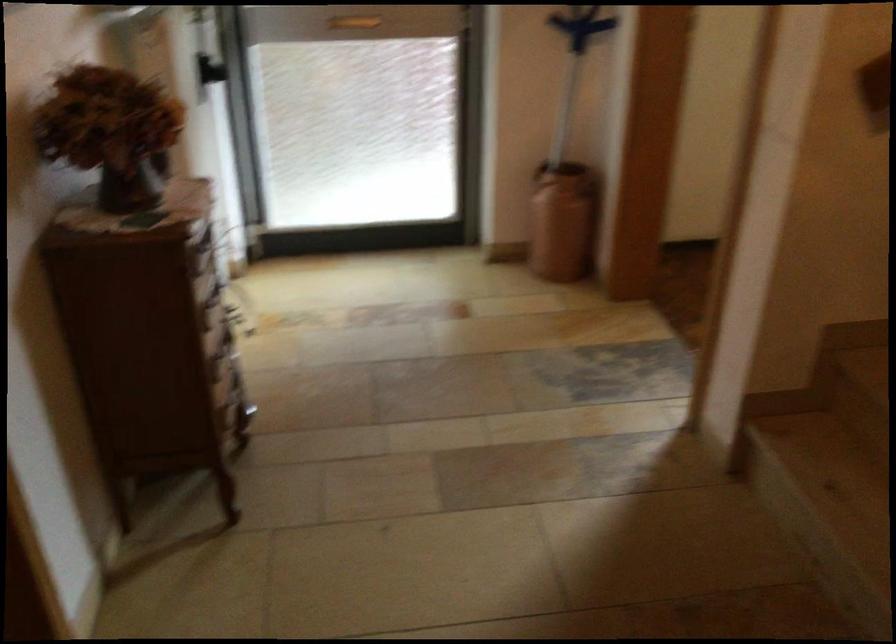
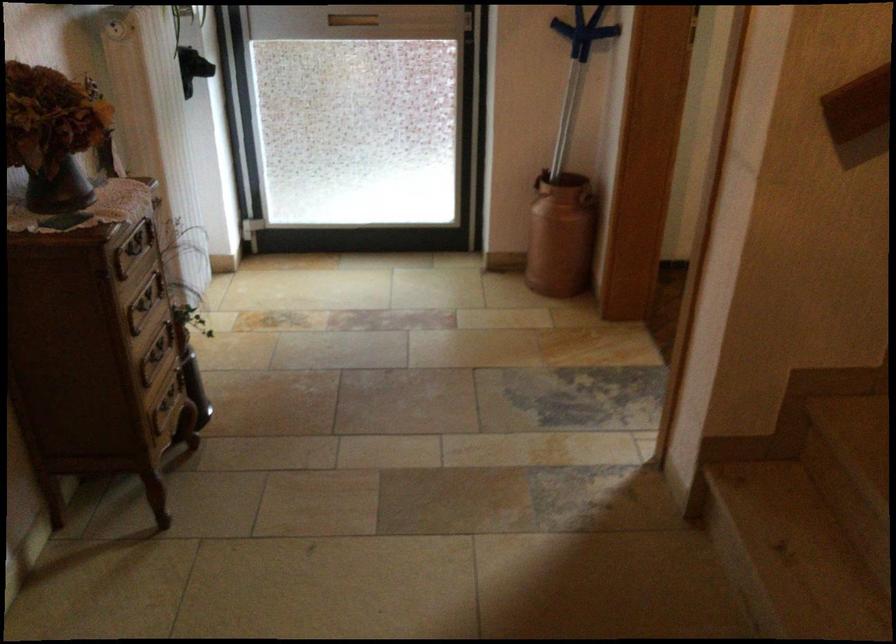
Where in the second image is the point corresponding to point 204,243 from the first image?

(133, 248)